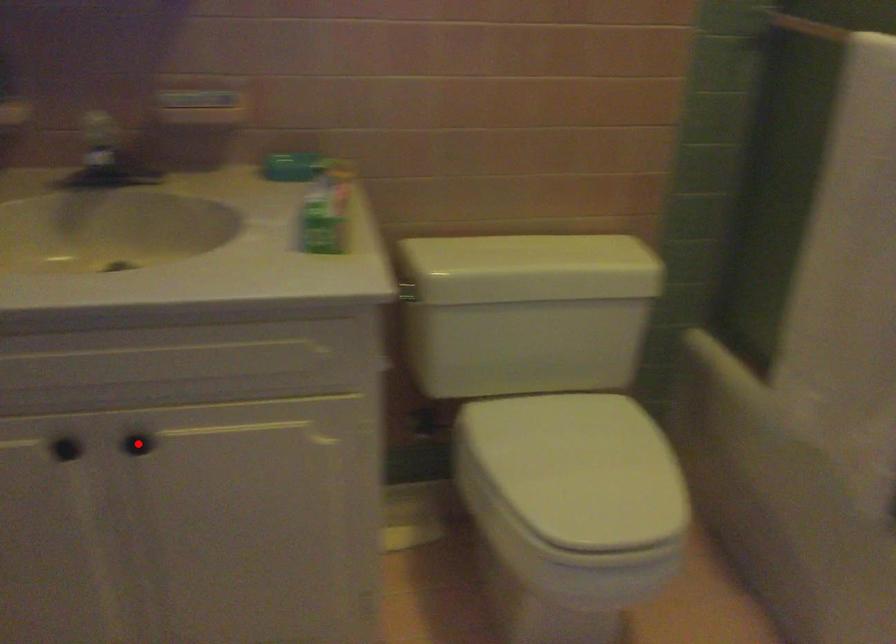
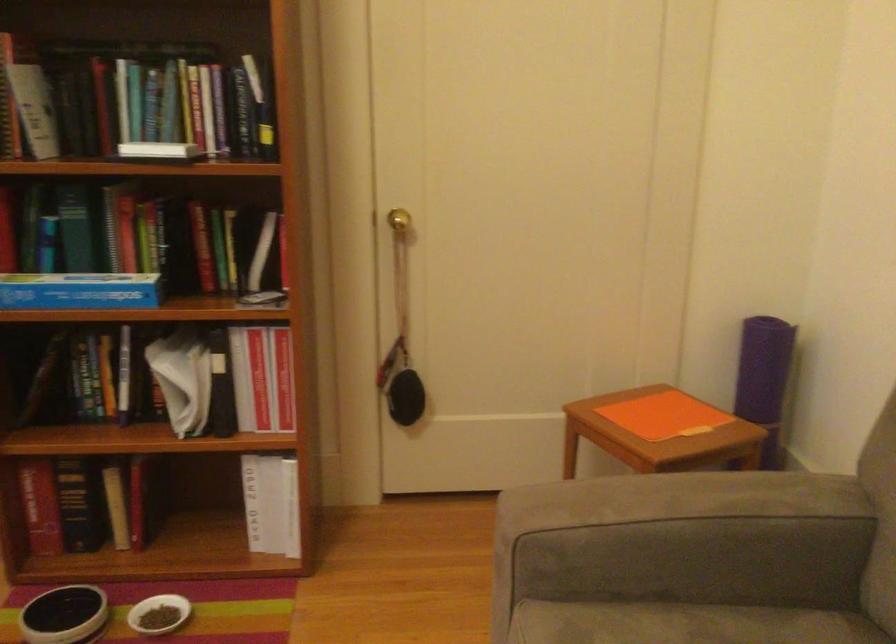
Question: I am providing you with two images of the same scene from different viewpoints. A red point is marked on the first image. Is the red point's position out of view in image 2?

Choices:
 (A) Yes
 (B) No

Answer: (A)